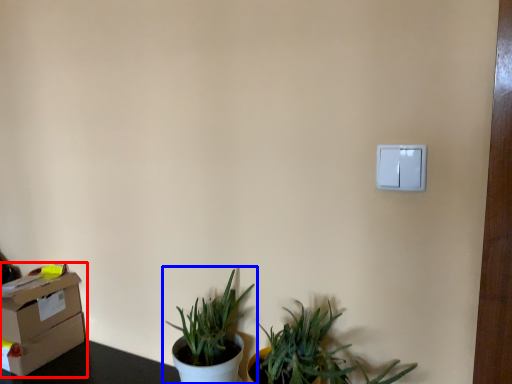
Question: Which object is further to the camera taking this photo, cardboard box (highlighted by a red box) or houseplant (highlighted by a blue box)?

Choices:
 (A) cardboard box
 (B) houseplant

Answer: (A)